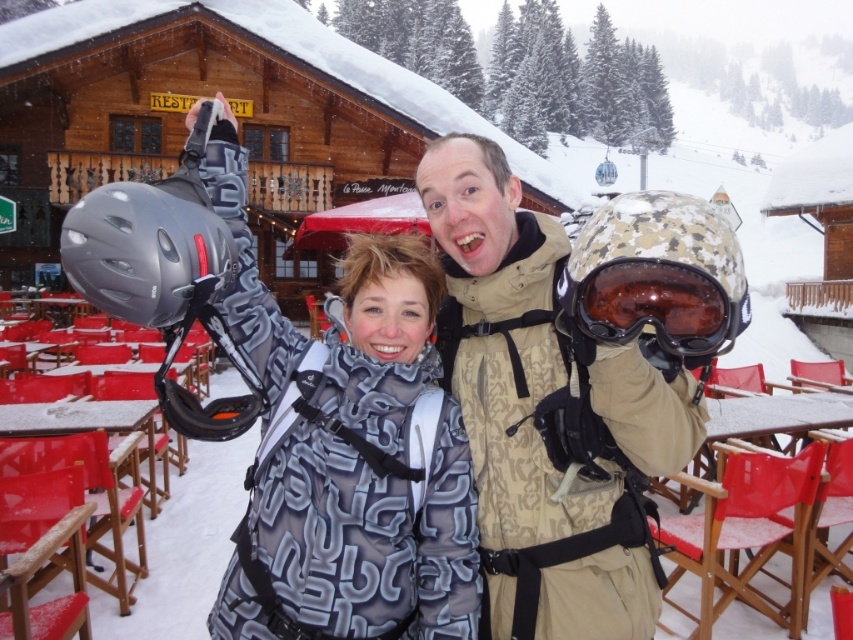
Is camouflage fabric helmet at center bigger than matte black goggles at center?

Correct, camouflage fabric helmet at center is larger in size than matte black goggles at center.

Based on the photo, can you confirm if camouflage fabric helmet at center is taller than matte black goggles at center?

Yes.

In order to click on camouflage fabric helmet at center in this screenshot , I will do `click(546, 413)`.

Is matte black helmet at upper center shorter than matte black goggles at center?

Incorrect, matte black helmet at upper center's height does not fall short of matte black goggles at center's.

Is point (416, 477) farther from viewer compared to point (570, 253)?

Yes, it is.

Does point (73, 232) come in front of point (653, 305)?

No, (73, 232) is further to viewer.

Find the location of a particular element. matte black helmet at upper center is located at coordinates (544, 417).

Does matte black helmet at upper center appear over camouflage fabric helmet at center?

Incorrect, matte black helmet at upper center is not positioned above camouflage fabric helmet at center.

From the picture: Which is above, matte black helmet at upper center or camouflage fabric helmet at center?

Positioned higher is camouflage fabric helmet at center.

At what (x,y) coordinates should I click in order to perform the action: click on matte black helmet at upper center. Please return your answer as a coordinate pair (x, y). Looking at the image, I should click on (544, 417).